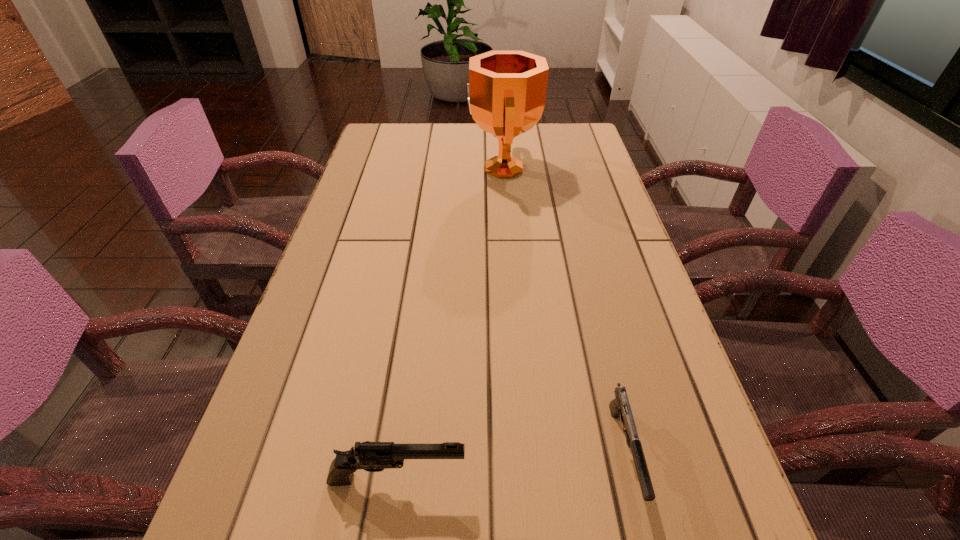
This screenshot has width=960, height=540. In order to click on award in this screenshot , I will do `click(506, 95)`.

Find the location of a particular element. the farthest object is located at coordinates (506, 95).

Image resolution: width=960 pixels, height=540 pixels. Identify the location of the left gun. (370, 456).

Locate an element on the screen. Image resolution: width=960 pixels, height=540 pixels. the taller gun is located at coordinates (370, 456).

Identify the location of the shorter gun. (x=619, y=407).

Identify the location of the right gun. (619, 407).

Identify the location of vacant position located on the side of the farthest object with the star emblem. (411, 168).

At what (x,y) coordinates should I click in order to perform the action: click on vacant space situated 0.160m on the side of the farthest object with the star emblem. Please return your answer as a coordinate pair (x, y). This screenshot has height=540, width=960. Looking at the image, I should click on (415, 168).

You are a GUI agent. You are given a task and a screenshot of the screen. Output one action in this format:
    pyautogui.click(x=<x>, y=<y>)
    Task: Click on the free point located 0.280m on the side of the farthest object with the star emblem
    The width and height of the screenshot is (960, 540).
    Given the screenshot: What is the action you would take?
    pyautogui.click(x=374, y=168)

Locate an element on the screen. This screenshot has height=540, width=960. blank space located at the end of the barrel of the taller gun is located at coordinates (717, 478).